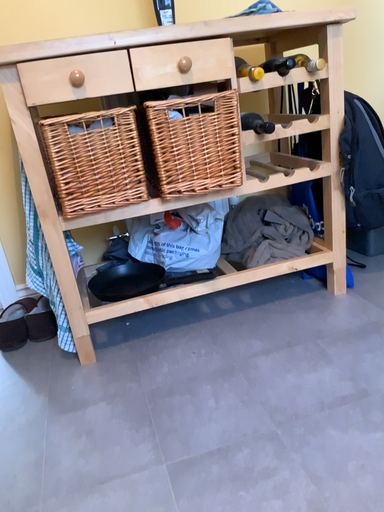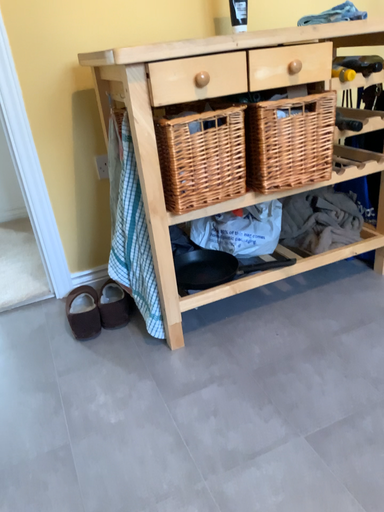
Question: How did the camera likely rotate when shooting the video?

Choices:
 (A) rotated right
 (B) rotated left

Answer: (A)